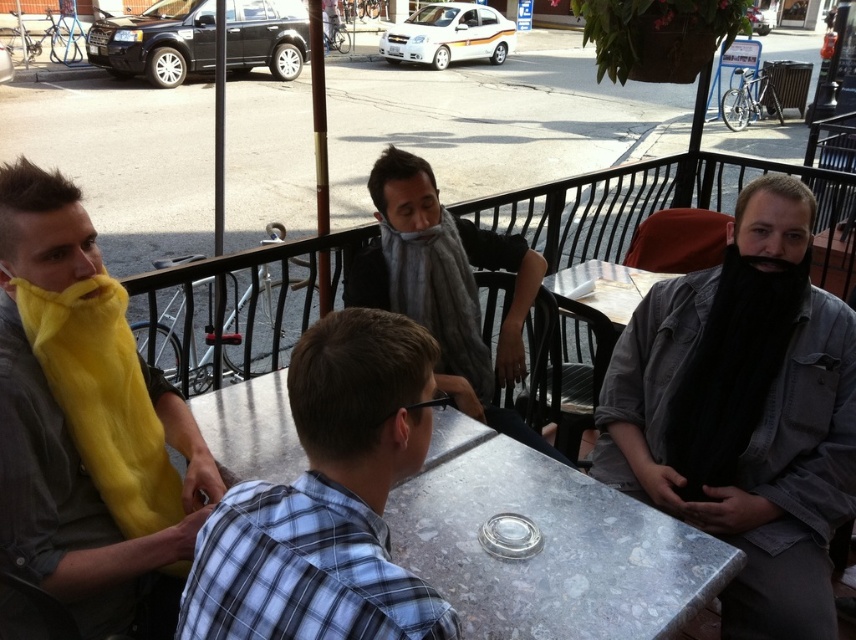
Question: Which of the following is the closest to the observer?

Choices:
 (A) (78, 225)
 (B) (730, 520)
 (C) (415, 300)

Answer: (A)

Question: Based on their relative distances, which object is nearer to the black fuzzy beard at right?

Choices:
 (A) gray fuzzy scarf at center
 (B) metallic gray table at center
 (C) yellow fuzzy scarf at left

Answer: (B)

Question: Can you confirm if metallic gray table at center is thinner than plaid shirt at center?

Choices:
 (A) no
 (B) yes

Answer: (A)

Question: Can you confirm if black matte beard at right is positioned below gray fuzzy scarf at center?

Choices:
 (A) no
 (B) yes

Answer: (B)

Question: Which of the following is the closest to the observer?

Choices:
 (A) plaid shirt at center
 (B) metallic gray table at center
 (C) black matte beard at right
 (D) black fuzzy beard at right

Answer: (A)

Question: Does black matte beard at right have a larger size compared to black fuzzy beard at right?

Choices:
 (A) yes
 (B) no

Answer: (A)